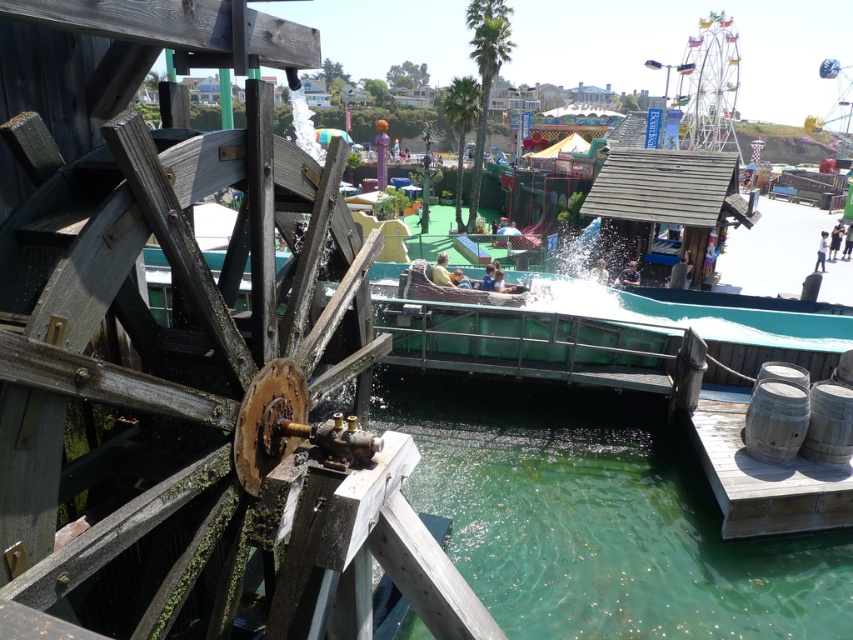
From the picture: Who is more distant from viewer, [164,627] or [799,582]?

Positioned behind is point [799,582].

Between rusty wood waterwheel at left and green translucent water at lower center, which one has more height?

rusty wood waterwheel at left

Is point (68, 508) farther from camera compared to point (566, 428)?

No, it is not.

I want to click on rusty wood waterwheel at left, so click(157, 371).

Can you confirm if rusty wood waterwheel at left is shorter than metallic ferris wheel at upper right?

Correct, rusty wood waterwheel at left is not as tall as metallic ferris wheel at upper right.

Does point (113, 422) lie in front of point (726, 108)?

Yes, it is in front of point (726, 108).

Is point (80, 296) positioned behind point (711, 96)?

No.

This screenshot has height=640, width=853. I want to click on rusty wood waterwheel at left, so click(157, 371).

Between point (827, 598) and point (746, 467), which one is positioned behind?

Point (746, 467)

Who is lower down, green translucent water at lower center or wooden barrels at lower right?

green translucent water at lower center

Find the location of `green translucent water at lower center`. green translucent water at lower center is located at coordinates (599, 516).

Find the location of a particular element. The image size is (853, 640). green translucent water at lower center is located at coordinates (599, 516).